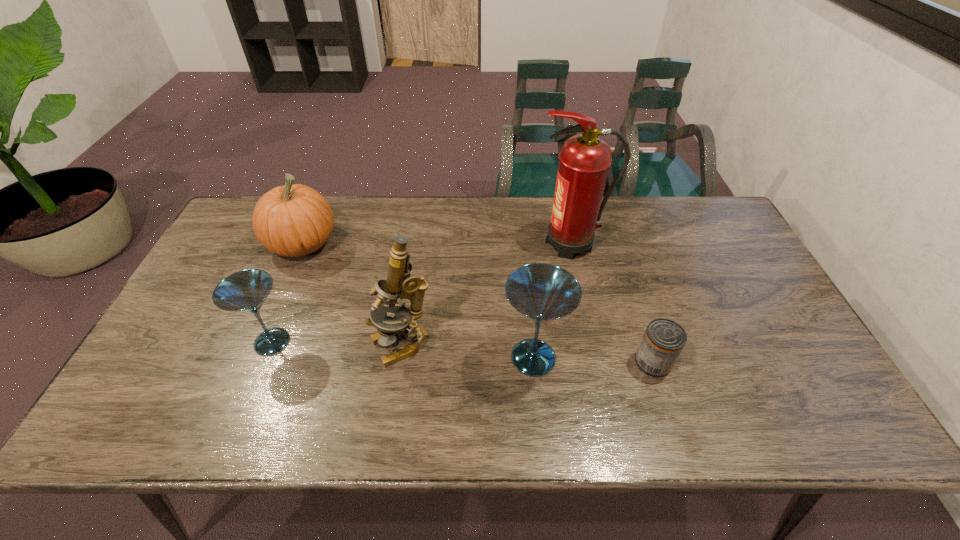
You are a GUI agent. You are given a task and a screenshot of the screen. Output one action in this format:
    pyautogui.click(x=<x>, y=<y>)
    Task: Click on the can situated at the near edge
    The height and width of the screenshot is (540, 960).
    Given the screenshot: What is the action you would take?
    pyautogui.click(x=664, y=339)

Find the location of a particular element. The height and width of the screenshot is (540, 960). object present at the left edge is located at coordinates (295, 220).

Locate an element on the screen. object situated at the far left corner is located at coordinates (295, 220).

The height and width of the screenshot is (540, 960). What are the coordinates of `free space at the far edge of the desktop` in the screenshot? It's located at (383, 226).

At what (x,y) coordinates should I click in order to perform the action: click on vacant space at the near edge of the desktop. Please return your answer as a coordinate pair (x, y). Looking at the image, I should click on (563, 383).

This screenshot has width=960, height=540. I want to click on vacant space at the left edge of the desktop, so click(205, 323).

Identify the location of vacant space at the right edge of the desktop. This screenshot has width=960, height=540. (700, 249).

Find the location of `free space at the far right corner`. free space at the far right corner is located at coordinates (699, 214).

This screenshot has height=540, width=960. Find the location of `unoccupied position between the microscope and the tallest object`. unoccupied position between the microscope and the tallest object is located at coordinates (487, 295).

Find the location of a particular element. vacant region between the shortest object and the tallest object is located at coordinates (612, 303).